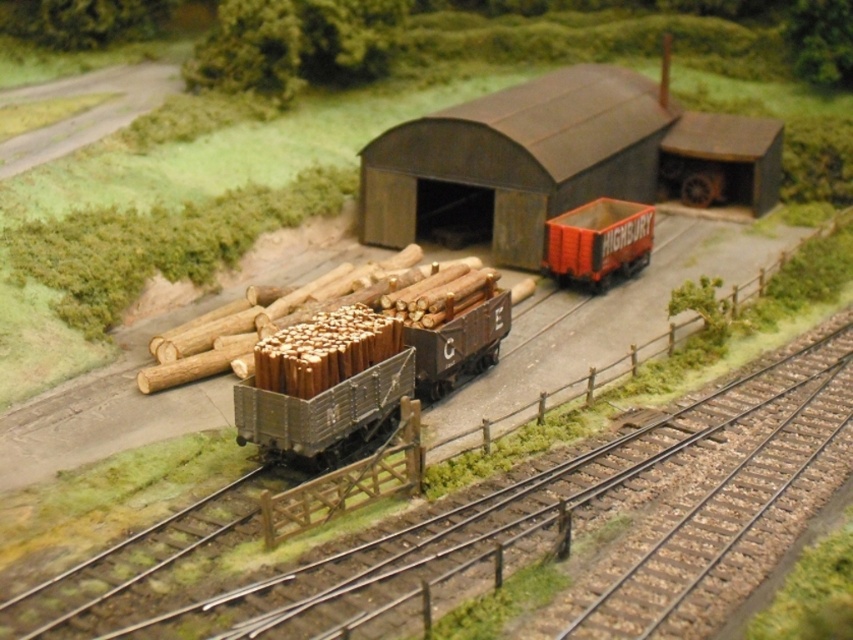
Question: Which of these objects is positioned closest to the orange plastic truck at center?

Choices:
 (A) dark gray corrugated metal barn at center
 (B) metal track at center

Answer: (A)

Question: Which point is closer to the camera?

Choices:
 (A) orange plastic truck at center
 (B) metal track at center

Answer: (B)

Question: Does dark gray corrugated metal barn at center have a smaller size compared to orange plastic truck at center?

Choices:
 (A) no
 (B) yes

Answer: (A)

Question: Does metal track at center lie behind dark gray corrugated metal barn at center?

Choices:
 (A) yes
 (B) no

Answer: (B)

Question: Is metal track at center below dark gray corrugated metal barn at center?

Choices:
 (A) no
 (B) yes

Answer: (B)

Question: Which of the following is the closest to the observer?

Choices:
 (A) (381, 241)
 (B) (567, 465)
 (C) (601, 205)

Answer: (B)